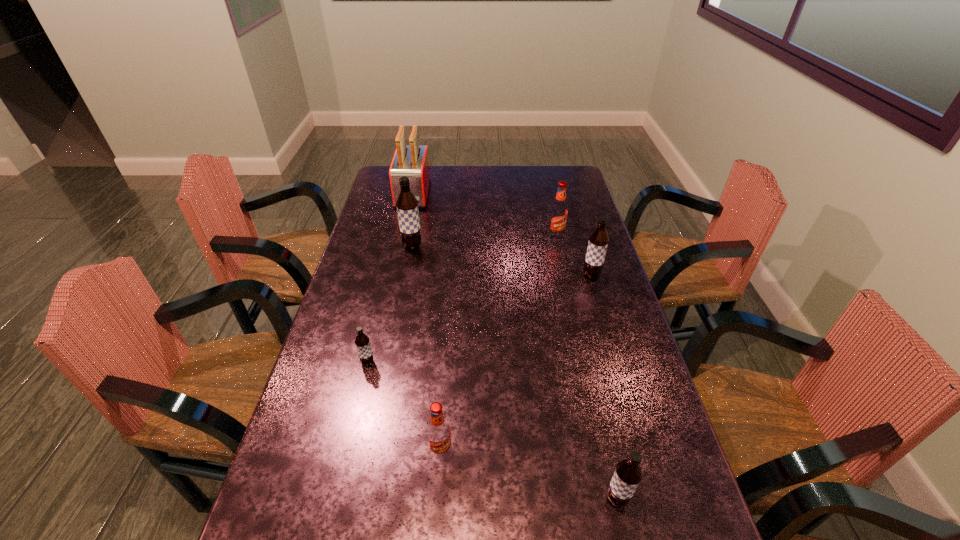
Identify the location of the second brown root beer from right to left. The width and height of the screenshot is (960, 540). (628, 473).

Where is `the nearest brown root beer`? The image size is (960, 540). the nearest brown root beer is located at coordinates (628, 473).

The image size is (960, 540). What are the coordinates of `the shortest root beer` in the screenshot? It's located at click(362, 342).

I want to click on the leftmost root beer, so click(362, 342).

You are a GUI agent. You are given a task and a screenshot of the screen. Output one action in this format:
    pyautogui.click(x=<x>, y=<y>)
    Task: Click on the vacant area located on the front-facing side of the toaster
    The image size is (960, 540).
    Given the screenshot: What is the action you would take?
    pyautogui.click(x=397, y=267)

Locate an element on the screen. free space located on the front of the biggest brown root beer is located at coordinates (398, 315).

Locate an element on the screen. Image resolution: width=960 pixels, height=540 pixels. free point located on the left of the farther red root beer is located at coordinates (450, 237).

At what (x,y) coordinates should I click in order to perform the action: click on free location located 0.120m on the front of the third smallest brown root beer. Please return your answer as a coordinate pair (x, y). The width and height of the screenshot is (960, 540). Looking at the image, I should click on (601, 308).

I want to click on vacant space located on the right of the second nearest root beer, so click(x=540, y=451).

This screenshot has height=540, width=960. I want to click on free location located on the back of the nearest root beer, so click(609, 460).